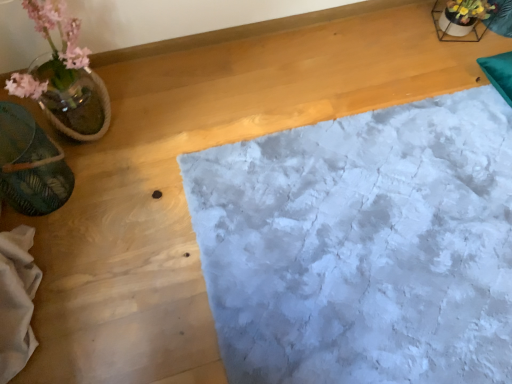
This screenshot has width=512, height=384. Identify the location of green leafy material at left. (31, 164).

What is the approximate width of translucent glass vase at left?

translucent glass vase at left is 14.10 inches in width.

What do you see at coordinates (64, 77) in the screenshot? The image size is (512, 384). I see `translucent glass vase at left` at bounding box center [64, 77].

Where is `white textured rug at center`? The height and width of the screenshot is (384, 512). white textured rug at center is located at coordinates (362, 246).

Can you confirm if white textured rug at center is wider than translucent glass vase at left?

Correct, the width of white textured rug at center exceeds that of translucent glass vase at left.

Which object is closer to the camera taking this photo, white textured rug at center or translucent glass vase at left?

translucent glass vase at left is closer to the camera.

Based on the photo, from a real-world perspective, is white textured rug at center on top of translucent glass vase at left?

No, from a real-world perspective, white textured rug at center is not above translucent glass vase at left.

Does green leafy material at left turn towards translucent glass vase at left?

No, green leafy material at left does not turn towards translucent glass vase at left.

Consider the image. In terms of width, does green leafy material at left look wider or thinner when compared to translucent glass vase at left?

Clearly, green leafy material at left has less width compared to translucent glass vase at left.

Is green leafy material at left not close to translucent glass vase at left?

No, green leafy material at left is in close proximity to translucent glass vase at left.

From a real-world perspective, does green leafy material at left stand above translucent glass vase at left?

No, from a real-world perspective, green leafy material at left is not above translucent glass vase at left.

Is there a large distance between translucent glass vase at left and green leafy material at left?

translucent glass vase at left is near green leafy material at left, not far away.

Which is farther from the camera, (30,13) or (37,163)?

The point (30,13) is behind.

Measure the distance between translucent glass vase at left and green leafy material at left.

They are 6.96 inches apart.

In the scene shown: In the image, is translucent glass vase at left positioned in front of or behind green leafy material at left?

translucent glass vase at left is positioned closer to the viewer than green leafy material at left.

In the scene shown: Which of these two, white textured rug at center or green leafy material at left, is smaller?

With smaller size is green leafy material at left.

Is white textured rug at center to the left or to the right of green leafy material at left in the image?

In the image, white textured rug at center appears on the right side of green leafy material at left.

Is green leafy material at left located within white textured rug at center?

No, green leafy material at left is located outside of white textured rug at center.

Based on the photo, does translucent glass vase at left come in front of white textured rug at center?

Yes, it is in front of white textured rug at center.

From the image's perspective, which one is positioned higher, translucent glass vase at left or white textured rug at center?

translucent glass vase at left, from the image's perspective.

Locate an element on the screen. houseplant located above the white textured rug at center (from the image's perspective) is located at coordinates (64, 77).

Is translucent glass vase at left facing towards white textured rug at center?

No, translucent glass vase at left is not aimed at white textured rug at center.

From the image's perspective, is green leafy material at left located beneath white textured rug at center?

No.

Is point (55, 178) positioned in front of point (374, 139)?

Yes, it is.

From a real-world perspective, between green leafy material at left and white textured rug at center, who is vertically lower?

white textured rug at center is physically lower.

Consider the image. Is green leafy material at left oriented away from white textured rug at center?

No.

Where is `sheet that appears behind the translucent glass vase at left`? This screenshot has height=384, width=512. sheet that appears behind the translucent glass vase at left is located at coordinates (362, 246).

Where is `houseplant on the right of green leafy material at left`? houseplant on the right of green leafy material at left is located at coordinates (64, 77).

From the picture: When comparing their distances from translucent glass vase at left, does white textured rug at center or green leafy material at left seem further?

white textured rug at center is further to translucent glass vase at left.

From the image, which object appears to be nearer to green leafy material at left, white textured rug at center or translucent glass vase at left?

Among the two, translucent glass vase at left is located nearer to green leafy material at left.

Estimate the real-world distances between objects in this image. Which object is closer to white textured rug at center, translucent glass vase at left or green leafy material at left?

translucent glass vase at left is positioned closer to the anchor white textured rug at center.

Based on their spatial positions, is green leafy material at left or translucent glass vase at left further from white textured rug at center?

green leafy material at left is positioned further to the anchor white textured rug at center.

Based on their spatial positions, is green leafy material at left or white textured rug at center closer to translucent glass vase at left?

Among the two, green leafy material at left is located nearer to translucent glass vase at left.

Looking at the image, which one is located further to green leafy material at left, translucent glass vase at left or white textured rug at center?

white textured rug at center is further to green leafy material at left.

Locate an element on the screen. This screenshot has width=512, height=384. houseplant between green leafy material at left and white textured rug at center from left to right is located at coordinates (64, 77).